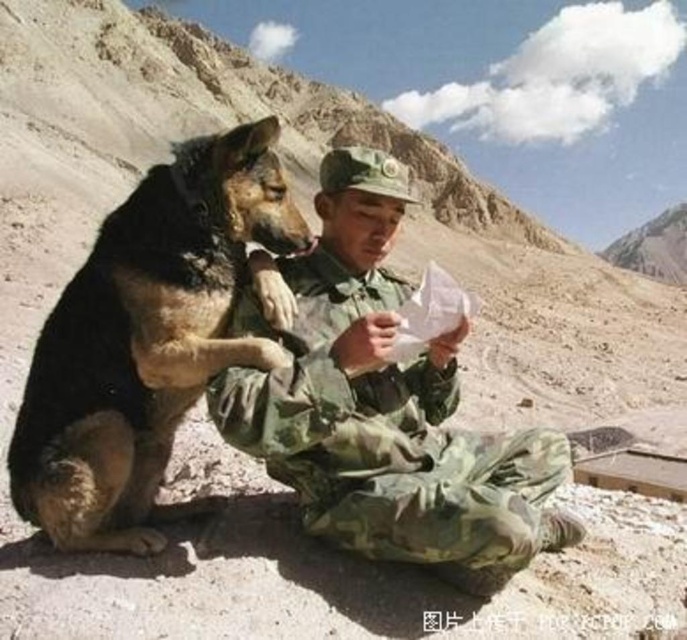
Consider the image. How distant is camouflage uniform at center from black fur dog at left?

camouflage uniform at center and black fur dog at left are 6.24 meters apart from each other.

Is camouflage uniform at center bigger than black fur dog at left?

No, camouflage uniform at center is not bigger than black fur dog at left.

The image size is (687, 640). What do you see at coordinates (383, 406) in the screenshot? I see `camouflage uniform at center` at bounding box center [383, 406].

You are a GUI agent. You are given a task and a screenshot of the screen. Output one action in this format:
    pyautogui.click(x=<x>, y=<y>)
    Task: Click on the camouflage uniform at center
    The height and width of the screenshot is (640, 687).
    Given the screenshot: What is the action you would take?
    pyautogui.click(x=383, y=406)